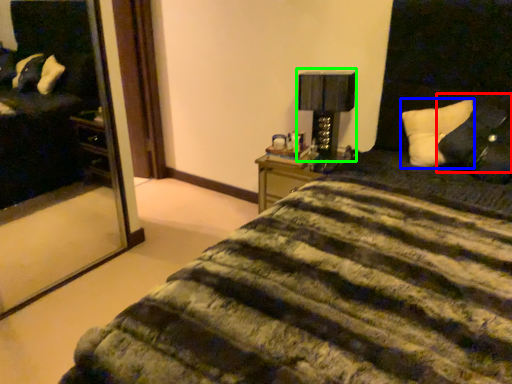
Question: Which object is the closest to the pillow (highlighted by a red box)? Choose among these: pillow (highlighted by a blue box) or table lamp (highlighted by a green box).

Choices:
 (A) pillow
 (B) table lamp

Answer: (A)